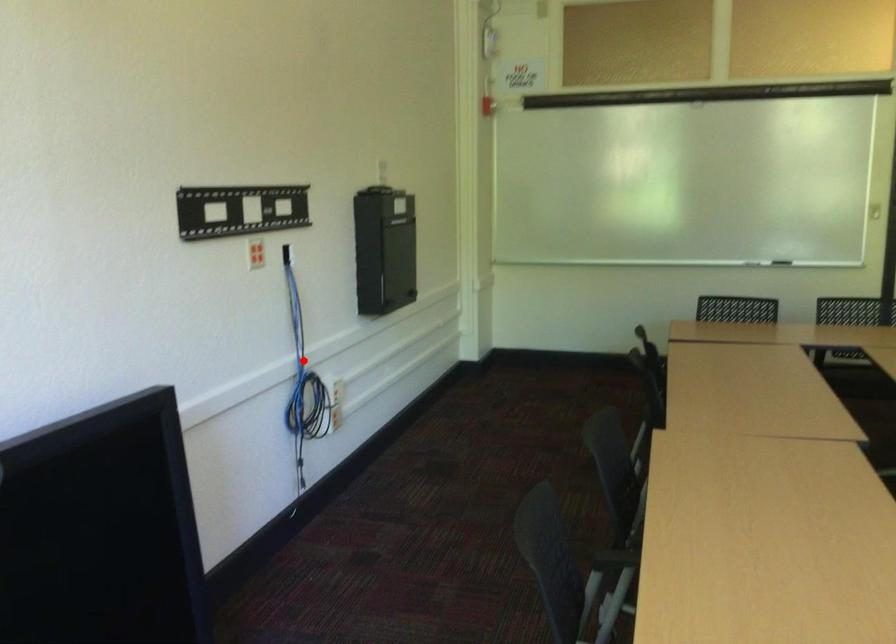
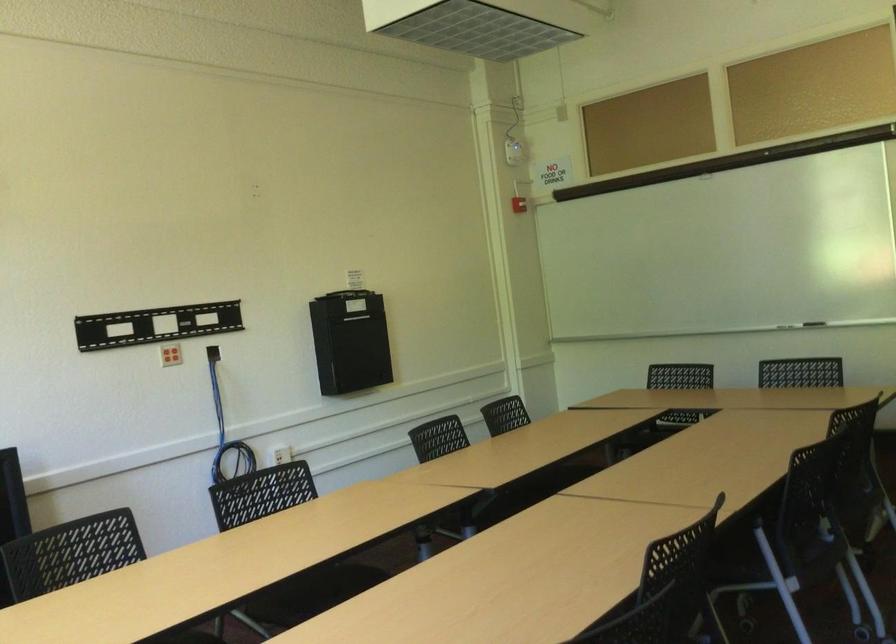
Question: I am providing you with two images of the same scene from different viewpoints. A red point is marked on the first image. At the location where the point appears in image 1, is it still visible in image 2?

Choices:
 (A) Yes
 (B) No

Answer: (A)